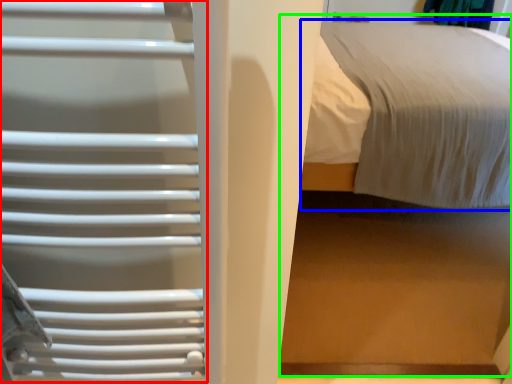
Question: Estimate the real-world distances between objects in this image. Which object is closer to cage (highlighted by a red box), bed (highlighted by a blue box) or bed (highlighted by a green box)?

Choices:
 (A) bed
 (B) bed

Answer: (B)